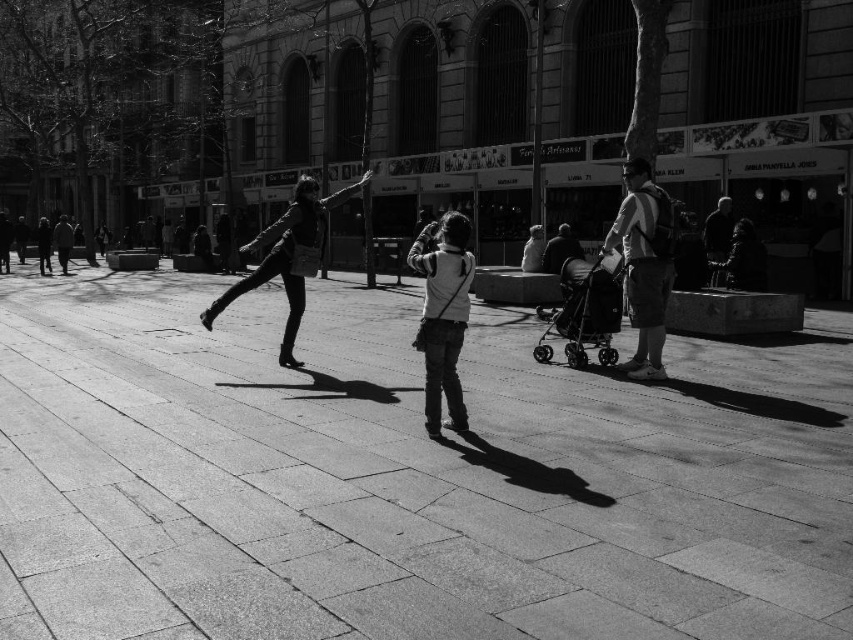
Who is lower down, smooth concrete pavement at center or matte black jacket at center?

Positioned lower is smooth concrete pavement at center.

How far apart are smooth concrete pavement at center and matte black jacket at center?

The distance of smooth concrete pavement at center from matte black jacket at center is 2.89 meters.

Is point (515, 464) positioned before point (241, 282)?

Yes, it is.

Locate an element on the screen. smooth concrete pavement at center is located at coordinates (404, 476).

Does smooth concrete pavement at center have a greater height compared to denim pants at center?

No, smooth concrete pavement at center is not taller than denim pants at center.

Does point (465, 566) come in front of point (451, 360)?

Yes, point (465, 566) is closer to viewer.

Identify the location of smooth concrete pavement at center. (404, 476).

The height and width of the screenshot is (640, 853). Find the location of `smooth concrete pavement at center`. smooth concrete pavement at center is located at coordinates (404, 476).

Which is more to the right, smooth concrete pavement at center or matte gray backpack at right?

Positioned to the right is matte gray backpack at right.

Can you confirm if smooth concrete pavement at center is bigger than matte gray backpack at right?

Yes.

Identify the location of smooth concrete pavement at center. (404, 476).